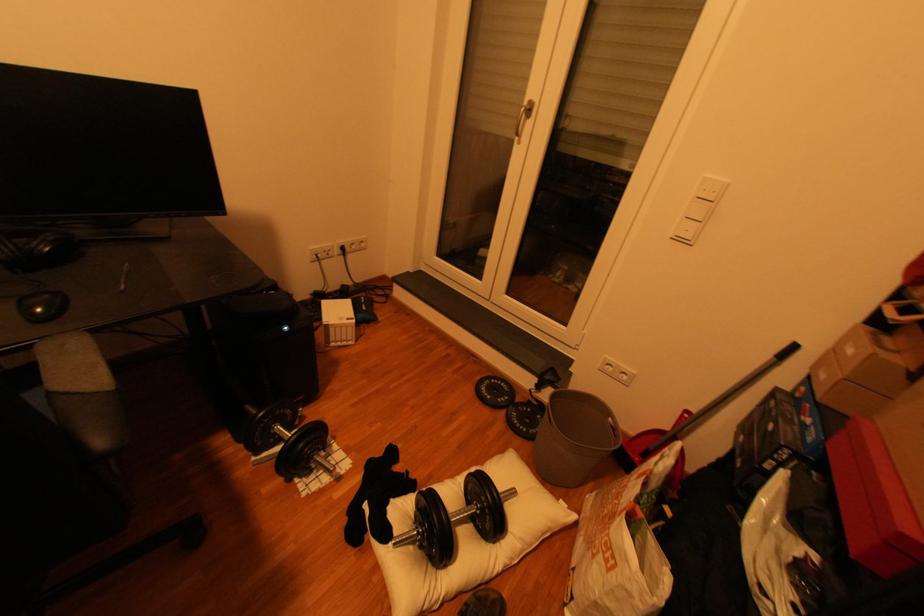
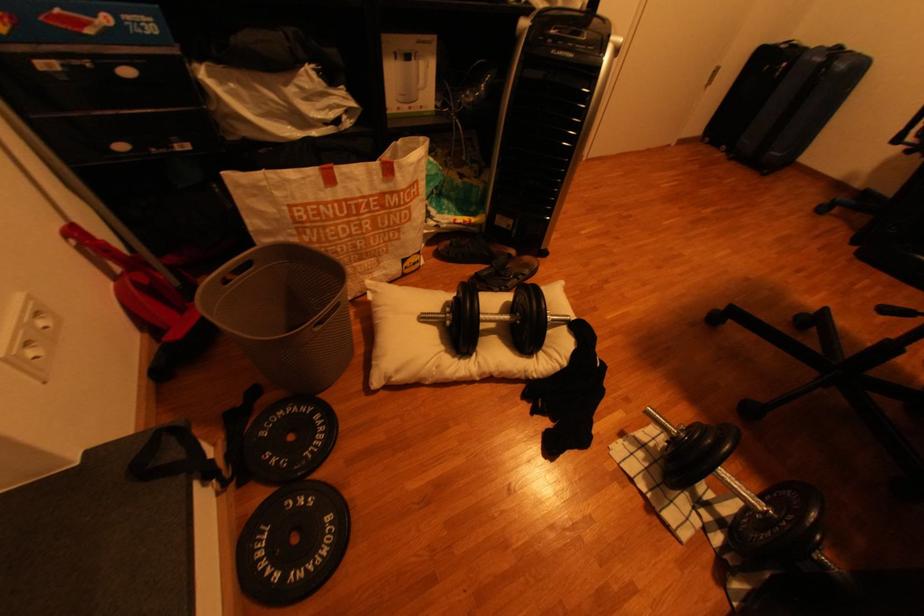
Locate, in the second image, the point that corresponds to (x=515, y=389) in the first image.

(274, 540)